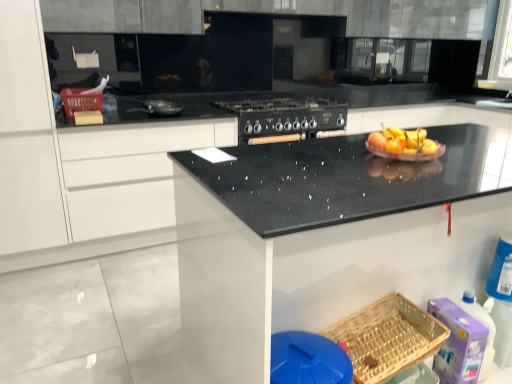
This screenshot has width=512, height=384. What do you see at coordinates (404, 145) in the screenshot?
I see `translucent glass bowl at center` at bounding box center [404, 145].

This screenshot has width=512, height=384. In order to click on shiny silver frying pan at center, which ranks as the 1th appliance in front-to-back order in this screenshot , I will do (156, 107).

The width and height of the screenshot is (512, 384). Describe the element at coordinates (156, 107) in the screenshot. I see `shiny silver frying pan at center, which ranks as the 1th appliance in front-to-back order` at that location.

Locate an element on the screen. Image resolution: width=512 pixels, height=384 pixels. purple plastic cleaning product at lower right is located at coordinates (458, 344).

Locate an element on the screen. The height and width of the screenshot is (384, 512). black speckled granite at center is located at coordinates (353, 221).

What do you see at coordinates (285, 117) in the screenshot? I see `black matte stove at center, the first appliance viewed from the back` at bounding box center [285, 117].

The width and height of the screenshot is (512, 384). What are the coordinates of `translucent glass bowl at center` in the screenshot? It's located at (404, 145).

Are purple plastic cleaning product at lower right and woven wood basket at lower right, acting as the first basket starting from the front, located far from each other?

purple plastic cleaning product at lower right is near woven wood basket at lower right, acting as the first basket starting from the front, not far away.

Which is behind, point (454, 376) or point (414, 335)?

The point (454, 376) is farther.

Could you tell me if purple plastic cleaning product at lower right is facing woven wood basket at lower right, which ranks as the second basket in back-to-front order?

No, purple plastic cleaning product at lower right does not turn towards woven wood basket at lower right, which ranks as the second basket in back-to-front order.

Could woven wood basket at lower right, arranged as the second basket when viewed from the top, be considered to be inside purple plastic cleaning product at lower right?

No, woven wood basket at lower right, arranged as the second basket when viewed from the top, is not inside purple plastic cleaning product at lower right.

Is black matte stove at center, the second appliance viewed from the front, inside the boundaries of woven wood basket at lower right, acting as the first basket starting from the front, or outside?

black matte stove at center, the second appliance viewed from the front, is not enclosed by woven wood basket at lower right, acting as the first basket starting from the front.

Visually, is black matte stove at center, which ranks as the 1th appliance in right-to-left order, positioned to the left or to the right of woven wood basket at lower right, which is the second basket from left to right?

Based on their positions, black matte stove at center, which ranks as the 1th appliance in right-to-left order, is located to the left of woven wood basket at lower right, which is the second basket from left to right.

Which is in front, black matte stove at center, which ranks as the 1th appliance in right-to-left order, or woven wood basket at lower right, acting as the first basket starting from the front?

Positioned in front is woven wood basket at lower right, acting as the first basket starting from the front.

Does black matte stove at center, the first appliance viewed from the back, have a larger size compared to woven wood basket at lower right, which is the second basket from left to right?

Yes.

Is black matte stove at center, which ranks as the 1th appliance in right-to-left order, taller or shorter than purple plastic cleaning product at lower right?

In the image, black matte stove at center, which ranks as the 1th appliance in right-to-left order, appears to be shorter than purple plastic cleaning product at lower right.

The width and height of the screenshot is (512, 384). Find the location of `the 2nd appliance positioned above the purple plastic cleaning product at lower right (from the image's perspective)`. the 2nd appliance positioned above the purple plastic cleaning product at lower right (from the image's perspective) is located at coordinates (285, 117).

From the picture: Is black matte stove at center, which ranks as the 1th appliance in right-to-left order, wider or thinner than purple plastic cleaning product at lower right?

Clearly, black matte stove at center, which ranks as the 1th appliance in right-to-left order, has more width compared to purple plastic cleaning product at lower right.

Is purple plastic cleaning product at lower right at the back of black matte stove at center, the second appliance viewed from the front?

No, black matte stove at center, the second appliance viewed from the front, is not facing the opposite direction of purple plastic cleaning product at lower right.

Do you think shiny silver frying pan at center, the second appliance in the back-to-front sequence, is within black matte stove at center, placed as the 2th appliance when sorted from left to right, or outside of it?

shiny silver frying pan at center, the second appliance in the back-to-front sequence, exists outside the volume of black matte stove at center, placed as the 2th appliance when sorted from left to right.

Is shiny silver frying pan at center, which is counted as the first appliance, starting from the left, turned away from black matte stove at center, which ranks as the 1th appliance in right-to-left order?

No, shiny silver frying pan at center, which is counted as the first appliance, starting from the left, is not facing away from black matte stove at center, which ranks as the 1th appliance in right-to-left order.

From a real-world perspective, between shiny silver frying pan at center, positioned as the 2th appliance in right-to-left order, and black matte stove at center, the second appliance viewed from the front, who is vertically higher?

In real-world perspective, shiny silver frying pan at center, positioned as the 2th appliance in right-to-left order, is above.

Can you confirm if shiny silver frying pan at center, which ranks as the 1th appliance in front-to-back order, is thinner than black matte stove at center, placed as the 2th appliance when sorted from left to right?

Correct, the width of shiny silver frying pan at center, which ranks as the 1th appliance in front-to-back order, is less than that of black matte stove at center, placed as the 2th appliance when sorted from left to right.

Is black matte stove at center, the second appliance viewed from the front, closer to the viewer compared to translucent glass bowl at center?

No, black matte stove at center, the second appliance viewed from the front, is further to the viewer.

From the translucent glass bowl at center, count 2nd appliances backward and point to it. Please provide its 2D coordinates.

[(285, 117)]

What's the angular difference between black matte stove at center, which ranks as the 1th appliance in right-to-left order, and translucent glass bowl at center's facing directions?

The angle between the facing direction of black matte stove at center, which ranks as the 1th appliance in right-to-left order, and the facing direction of translucent glass bowl at center is 1.65 degrees.

Is black matte stove at center, placed as the 2th appliance when sorted from left to right, located outside translucent glass bowl at center?

Indeed, black matte stove at center, placed as the 2th appliance when sorted from left to right, is completely outside translucent glass bowl at center.

Is black speckled granite at center looking in the opposite direction of translucent glass bowl at center?

No, black speckled granite at center's orientation is not away from translucent glass bowl at center.

Between black speckled granite at center and translucent glass bowl at center, which one appears on the right side from the viewer's perspective?

black speckled granite at center.

Considering the relative sizes of black speckled granite at center and translucent glass bowl at center in the image provided, is black speckled granite at center thinner than translucent glass bowl at center?

Answer: Incorrect, the width of black speckled granite at center is not less than that of translucent glass bowl at center.

Is matte plastic basket at upper left, which is the 2th basket in right-to-left order, at the back of translucent glass bowl at center?

Correct, translucent glass bowl at center is looking away from matte plastic basket at upper left, which is the 2th basket in right-to-left order.

Is translucent glass bowl at center completely or partially outside of matte plastic basket at upper left, the second basket in the front-to-back sequence?

Yes, translucent glass bowl at center is not within matte plastic basket at upper left, the second basket in the front-to-back sequence.

Which is less distant, (367,144) or (95,104)?

The point (367,144) is closer to the camera.

From a real-world perspective, is translucent glass bowl at center physically above matte plastic basket at upper left, acting as the 1th basket starting from the back?

Yes.

This screenshot has width=512, height=384. Identify the location of the 1st basket above when counting from the purple plastic cleaning product at lower right (from the image's perspective). (387, 338).

Locate an element on the screen. This screenshot has width=512, height=384. appliance that is the 1st object above the woven wood basket at lower right, the 1th basket when ordered from right to left (from a real-world perspective) is located at coordinates (285, 117).

When comparing their distances from black speckled granite at center, does translucent glass bowl at center or purple plastic cleaning product at lower right seem closer?

translucent glass bowl at center is closer to black speckled granite at center.

In the scene shown: When comparing their distances from matte plastic basket at upper left, the second basket in the front-to-back sequence, does black speckled granite at center or woven wood basket at lower right, which is the second basket from left to right, seem closer?

black speckled granite at center is closer to matte plastic basket at upper left, the second basket in the front-to-back sequence.

Based on their spatial positions, is translucent glass bowl at center or woven wood basket at lower right, arranged as the second basket when viewed from the top, further from matte plastic basket at upper left, placed as the second basket when sorted from bottom to top?

Among the two, woven wood basket at lower right, arranged as the second basket when viewed from the top, is located further to matte plastic basket at upper left, placed as the second basket when sorted from bottom to top.

Looking at the image, which one is located closer to woven wood basket at lower right, arranged as the second basket when viewed from the top, translucent glass bowl at center or shiny silver frying pan at center, the second appliance in the back-to-front sequence?

translucent glass bowl at center.

Which object lies nearer to the anchor point black speckled granite at center, woven wood basket at lower right, the 1th basket from the bottom, or purple plastic cleaning product at lower right?

woven wood basket at lower right, the 1th basket from the bottom, is closer to black speckled granite at center.

Looking at the image, which one is located further to matte plastic basket at upper left, arranged as the first basket when viewed from the left, purple plastic cleaning product at lower right or translucent glass bowl at center?

purple plastic cleaning product at lower right lies further to matte plastic basket at upper left, arranged as the first basket when viewed from the left, than the other object.

When comparing their distances from translucent glass bowl at center, does black matte stove at center, placed as the 2th appliance when sorted from left to right, or purple plastic cleaning product at lower right seem closer?

The object closer to translucent glass bowl at center is purple plastic cleaning product at lower right.

Which object lies nearer to the anchor point black matte stove at center, the first appliance viewed from the back, translucent glass bowl at center or matte plastic basket at upper left, acting as the 1th basket starting from the back?

translucent glass bowl at center lies closer to black matte stove at center, the first appliance viewed from the back, than the other object.

This screenshot has height=384, width=512. Find the location of `fruit dish located between black speckled granite at center and shiny silver frying pan at center, which ranks as the 1th appliance in front-to-back order, in the depth direction`. fruit dish located between black speckled granite at center and shiny silver frying pan at center, which ranks as the 1th appliance in front-to-back order, in the depth direction is located at coordinates (404, 145).

Locate an element on the screen. Image resolution: width=512 pixels, height=384 pixels. basket located between black speckled granite at center and purple plastic cleaning product at lower right in the depth direction is located at coordinates (387, 338).

I want to click on basket between shiny silver frying pan at center, positioned as the 2th appliance in right-to-left order, and purple plastic cleaning product at lower right, so click(x=387, y=338).

At what (x,y) coordinates should I click in order to perform the action: click on appliance between matte plastic basket at upper left, placed as the second basket when sorted from bottom to top, and black matte stove at center, placed as the 2th appliance when sorted from left to right, from left to right. Please return your answer as a coordinate pair (x, y). This screenshot has height=384, width=512. Looking at the image, I should click on (156, 107).